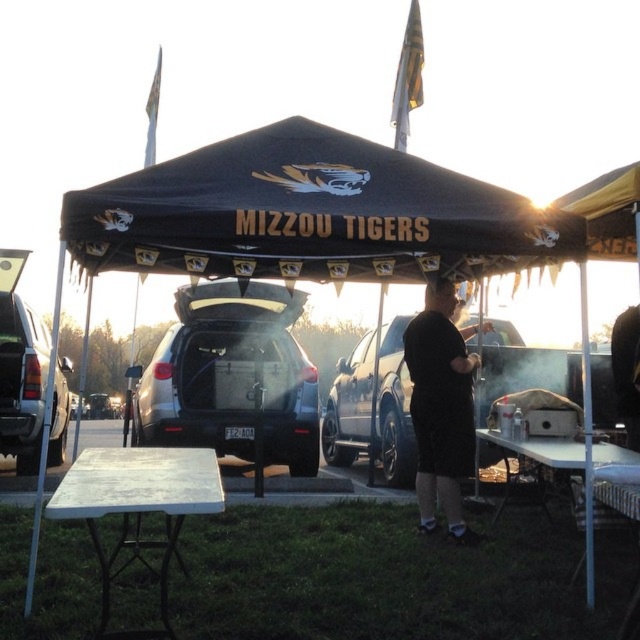
In the scene shown: Is black matte suv at center taller than silver metallic truck at left?

In fact, black matte suv at center may be shorter than silver metallic truck at left.

At what (x,y) coordinates should I click in order to perform the action: click on black matte suv at center. Please return your answer as a coordinate pair (x, y). Looking at the image, I should click on (394, 406).

Which is more to the right, white plastic picnic table at lower right or black matte grill at center?

From the viewer's perspective, black matte grill at center appears more on the right side.

Between point (554, 449) and point (620, 396), which one is positioned in front?

Point (554, 449) is more forward.

Is point (589, 554) in front of point (621, 314)?

Yes.

Image resolution: width=640 pixels, height=640 pixels. What are the coordinates of `white plastic picnic table at lower right` in the screenshot? It's located at (568, 468).

Is point (444, 369) more distant than point (636, 328)?

No, (444, 369) is closer to viewer.

Looking at this image, who is positioned more to the left, black matte shirt at center or black matte grill at center?

black matte shirt at center is more to the left.

Is point (452, 349) farther from viewer compared to point (634, 349)?

No, it is in front of (634, 349).

This screenshot has width=640, height=640. What are the coordinates of `black matte shirt at center` in the screenshot? It's located at (442, 406).